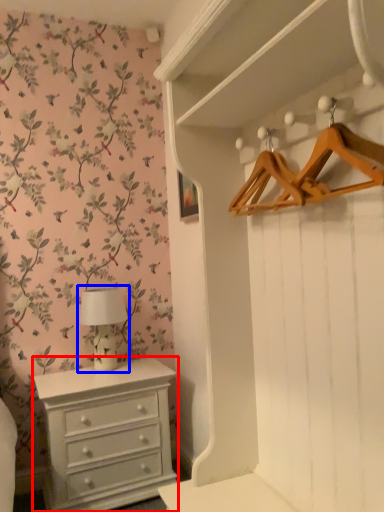
Question: Which point is further to the camera, chest of drawers (highlighted by a red box) or table lamp (highlighted by a blue box)?

Choices:
 (A) chest of drawers
 (B) table lamp

Answer: (B)